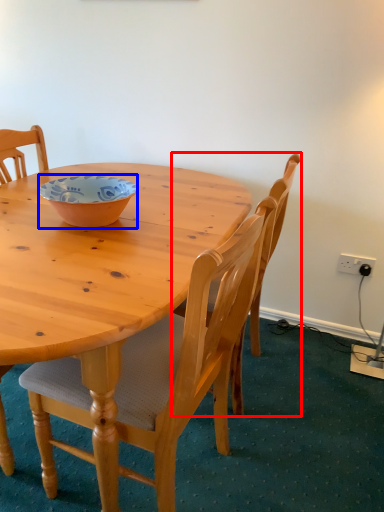
Question: Which object is further to the camera taking this photo, chair (highlighted by a red box) or bowl (highlighted by a blue box)?

Choices:
 (A) chair
 (B) bowl

Answer: (A)